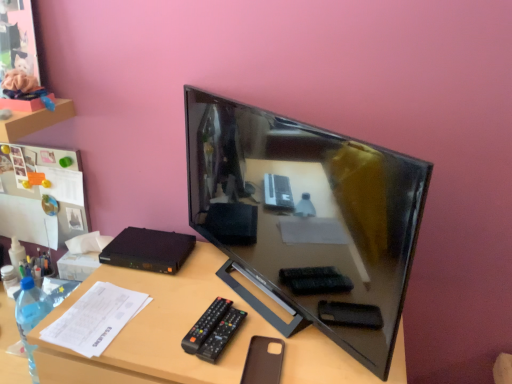
At what (x,y) coordinates should I click in order to perform the action: click on empty space that is to the right of black plastic remote at lower center. Please return your answer as a coordinate pair (x, y). Looking at the image, I should click on (291, 337).